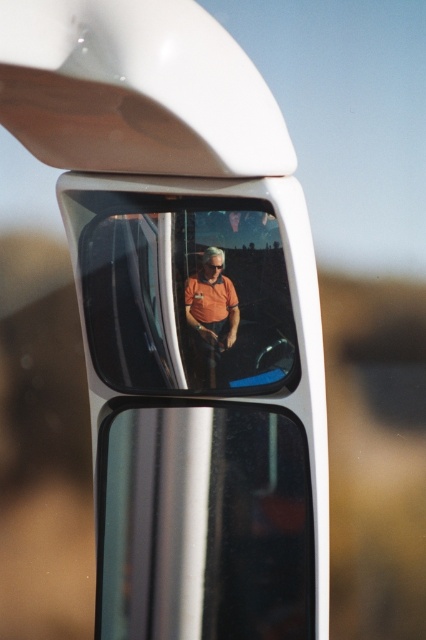
You are a driver checking your side mirror and notice a point marked at coordinates (184, 292). What object is located at that point in the mirror?

The point at coordinates (184, 292) marks the matte orange shirt at center.

You are a driver checking your side mirror and notice two orange matte shirts at the center of the mirror. The first is labeled as the matte orange shirt at center, and the second is labeled as the orange matte shirt at center. Which one is closer to you?

Both the matte orange shirt at center and the orange matte shirt at center are the same object, so there is no distance between them. However, the description mentions a distance of 2.02 inches between them, which might be due to a reflection or duplication effect in the mirror. In reality, they are the same person, so neither is closer.